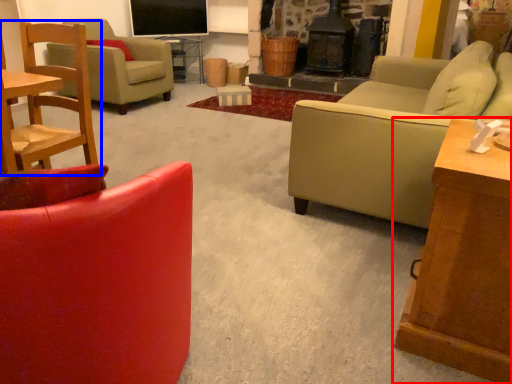
Question: Which point is further to the camera, table (highlighted by a red box) or chair (highlighted by a blue box)?

Choices:
 (A) table
 (B) chair

Answer: (B)